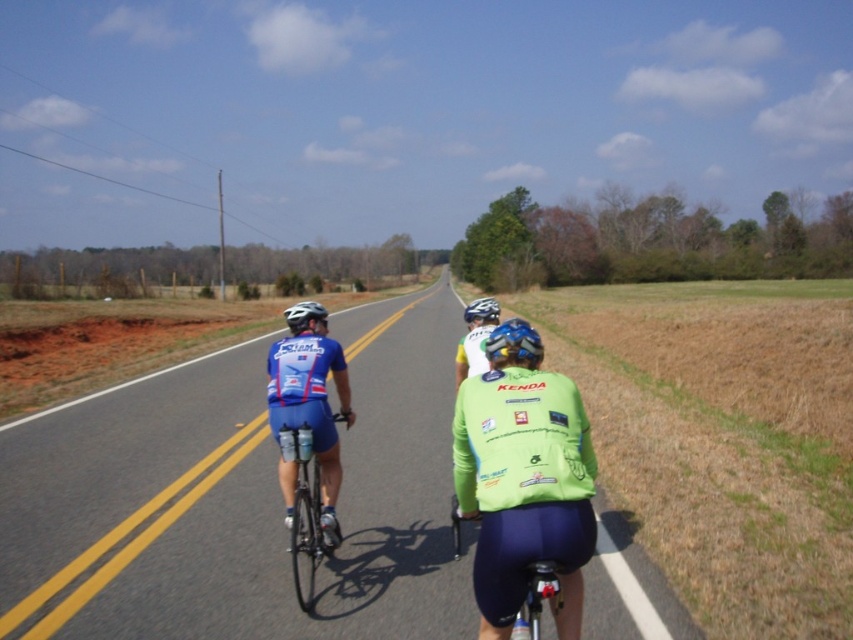
Does point (473, 312) come closer to viewer compared to point (489, 308)?

No.

Looking at this image, does light green jersey at center lie in front of white matte bicycle helmet at upper center?

Yes, it is in front of white matte bicycle helmet at upper center.

The image size is (853, 640). What do you see at coordinates (474, 337) in the screenshot?
I see `light green jersey at center` at bounding box center [474, 337].

You are a GUI agent. You are given a task and a screenshot of the screen. Output one action in this format:
    pyautogui.click(x=<x>, y=<y>)
    Task: Click on the light green jersey at center
    
    Given the screenshot: What is the action you would take?
    pyautogui.click(x=474, y=337)

Can you confirm if green jersey at center is wider than blue matte helmet at center?

Incorrect, green jersey at center's width does not surpass blue matte helmet at center's.

Does green jersey at center have a lesser width compared to blue matte helmet at center?

Correct, green jersey at center's width is less than blue matte helmet at center's.

Between point (523, 356) and point (524, 320), which one is positioned in front?

Positioned in front is point (523, 356).

You are a GUI agent. You are given a task and a screenshot of the screen. Output one action in this format:
    pyautogui.click(x=<x>, y=<y>)
    Task: Click on the green jersey at center
    The width and height of the screenshot is (853, 640).
    Given the screenshot: What is the action you would take?
    pyautogui.click(x=523, y=477)

From the picture: Is asphalt road at center to the right of light green jersey at center from the viewer's perspective?

No, asphalt road at center is not to the right of light green jersey at center.

Is asphalt road at center wider than light green jersey at center?

Indeed, asphalt road at center has a greater width compared to light green jersey at center.

What do you see at coordinates (238, 500) in the screenshot?
I see `asphalt road at center` at bounding box center [238, 500].

Image resolution: width=853 pixels, height=640 pixels. Find the location of `asphalt road at center`. asphalt road at center is located at coordinates (238, 500).